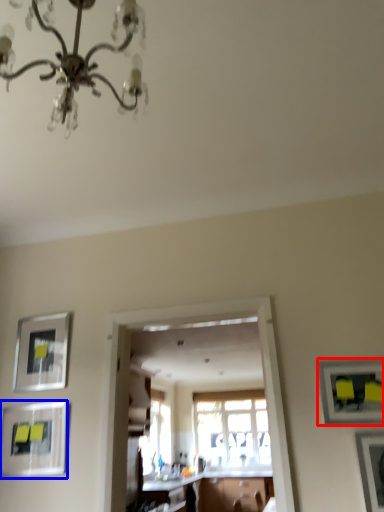
Question: Which object appears farthest to the camera in this image, picture frame (highlighted by a red box) or picture frame (highlighted by a blue box)?

Choices:
 (A) picture frame
 (B) picture frame

Answer: (B)